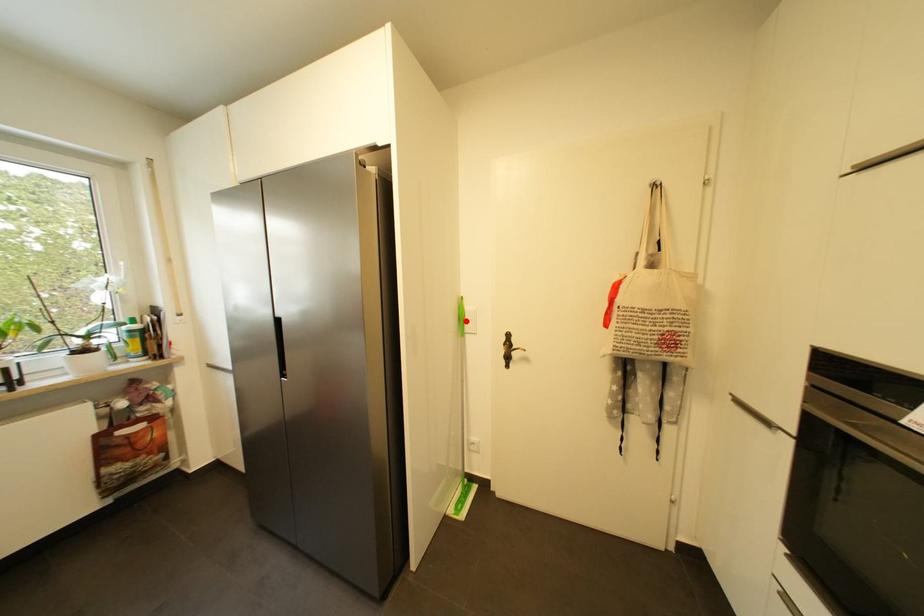
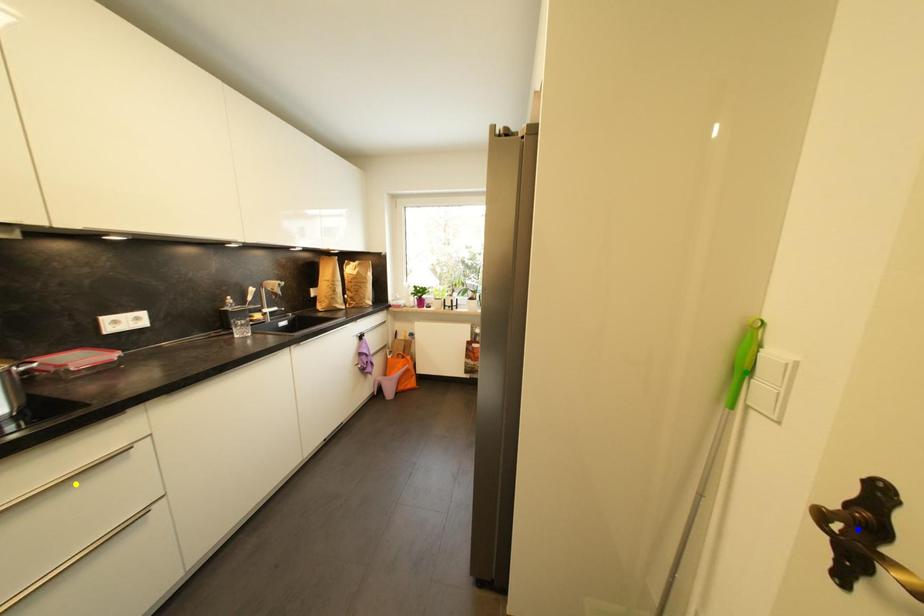
Question: I am providing you with two images of the same scene from different viewpoints. A red point is marked on the first image. You are given multiple points on the second image. Which spot in image 2 lines up with the point in image 1?

Choices:
 (A) green point
 (B) blue point
 (C) yellow point

Answer: (A)